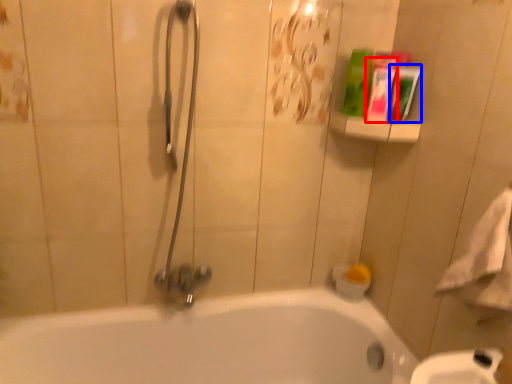
Question: Which object is further to the camera taking this photo, mouthwash (highlighted by a red box) or mouthwash (highlighted by a blue box)?

Choices:
 (A) mouthwash
 (B) mouthwash

Answer: (B)